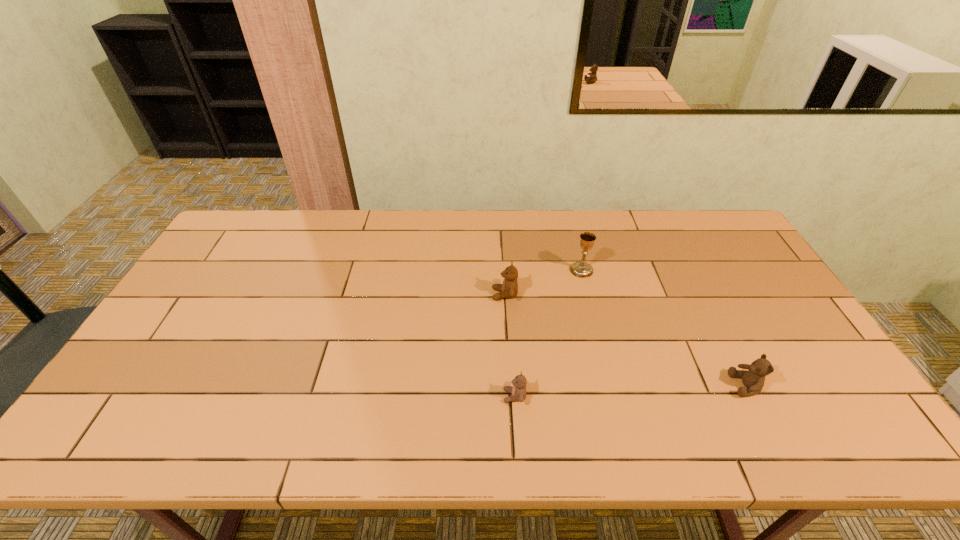
Identify the location of unoccupied area between the third nearest object and the chalice. (543, 282).

Identify the location of free space between the second tallest teddy bear and the farthest object. The width and height of the screenshot is (960, 540). (663, 328).

Select which object is the closest to the farthest teddy bear. Please provide its 2D coordinates. Your answer should be formatted as a tuple, i.e. [(x, y)], where the tuple contains the x and y coordinates of a point satisfying the conditions above.

[(581, 269)]

Image resolution: width=960 pixels, height=540 pixels. Identify the location of object that is the closest to the farthest teddy bear. (581, 269).

Choose which teddy bear is the nearest neighbor to the rightmost object. Please provide its 2D coordinates. Your answer should be formatted as a tuple, i.e. [(x, y)], where the tuple contains the x and y coordinates of a point satisfying the conditions above.

[(518, 391)]

Find the location of a particular element. This screenshot has width=960, height=540. teddy bear that stands as the closest to the chalice is located at coordinates (509, 289).

Where is `blank space that satisfies the following two spatial constraints: 1. on the front side of the third object from left to right; 2. on the front-facing side of the farthest teddy bear`? The width and height of the screenshot is (960, 540). blank space that satisfies the following two spatial constraints: 1. on the front side of the third object from left to right; 2. on the front-facing side of the farthest teddy bear is located at coordinates (588, 294).